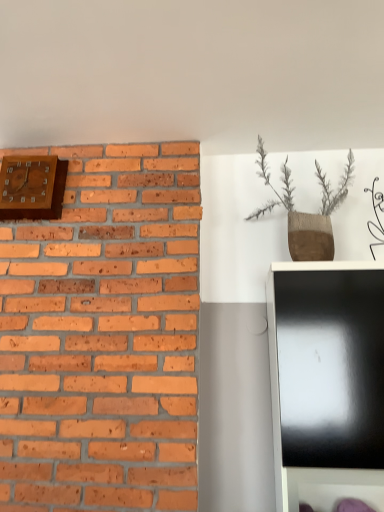
Question: Is wooden clock at upper left wider or thinner than textured brown vase at upper right?

Choices:
 (A) wide
 (B) thin

Answer: (B)

Question: In the image, is wooden clock at upper left positioned in front of or behind textured brown vase at upper right?

Choices:
 (A) behind
 (B) front

Answer: (A)

Question: Is point (21, 193) closer or farther from the camera than point (319, 245)?

Choices:
 (A) closer
 (B) farther

Answer: (B)

Question: From the image's perspective, relative to wooden clock at upper left, is textured brown vase at upper right above or below?

Choices:
 (A) below
 (B) above

Answer: (A)

Question: Looking at their shapes, would you say textured brown vase at upper right is wider or thinner than wooden clock at upper left?

Choices:
 (A) wide
 (B) thin

Answer: (A)

Question: Based on their sizes in the image, would you say textured brown vase at upper right is bigger or smaller than wooden clock at upper left?

Choices:
 (A) big
 (B) small

Answer: (A)

Question: Choose the correct answer: Is textured brown vase at upper right inside wooden clock at upper left or outside it?

Choices:
 (A) inside
 (B) outside

Answer: (B)